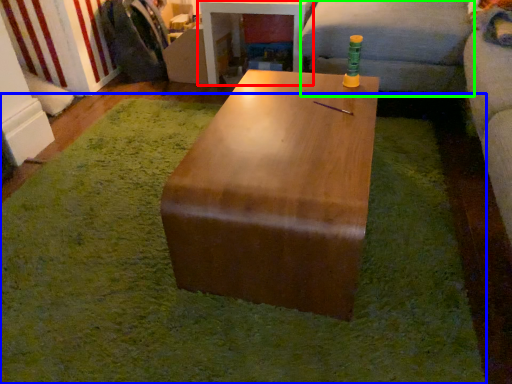
Question: Which is farther away from table (highlighted by a red box)? mat (highlighted by a blue box) or couch (highlighted by a green box)?

Choices:
 (A) mat
 (B) couch

Answer: (A)